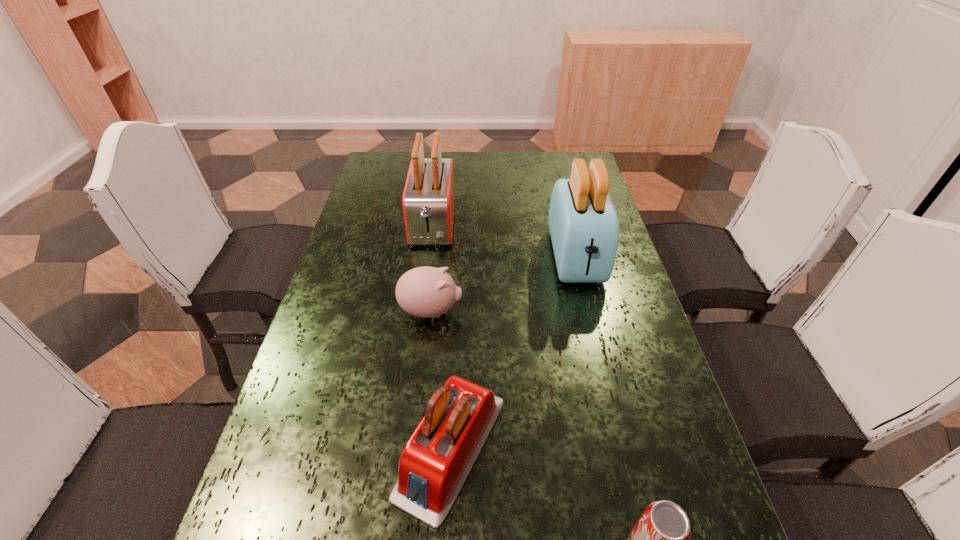
Find the location of `the rightmost toaster`. the rightmost toaster is located at coordinates (583, 223).

Identify the location of the nearest toaster. The height and width of the screenshot is (540, 960). (436, 461).

The height and width of the screenshot is (540, 960). I want to click on the third shortest object, so click(436, 461).

Where is `the third nearest object`? The height and width of the screenshot is (540, 960). the third nearest object is located at coordinates (425, 292).

Image resolution: width=960 pixels, height=540 pixels. What are the coordinates of `free space located 0.290m on the side of the rightmost toaster with the lever` in the screenshot? It's located at (607, 386).

Find the location of a particular element. The width and height of the screenshot is (960, 540). vacant area located on the back of the nearest toaster is located at coordinates (458, 305).

The height and width of the screenshot is (540, 960). I want to click on blank space located at the snout of the piggy bank, so click(482, 311).

The image size is (960, 540). Identify the location of object located in the right edge section of the desktop. (583, 223).

You are a GUI agent. You are given a task and a screenshot of the screen. Output one action in this format:
    pyautogui.click(x=<x>, y=<y>)
    Task: Click on the vacant space at the far edge
    
    Given the screenshot: What is the action you would take?
    pyautogui.click(x=495, y=179)

You are a GUI agent. You are given a task and a screenshot of the screen. Output one action in this format:
    pyautogui.click(x=<x>, y=<y>)
    Task: Click on the vacant space at the left edge of the desktop
    
    Given the screenshot: What is the action you would take?
    pyautogui.click(x=362, y=195)